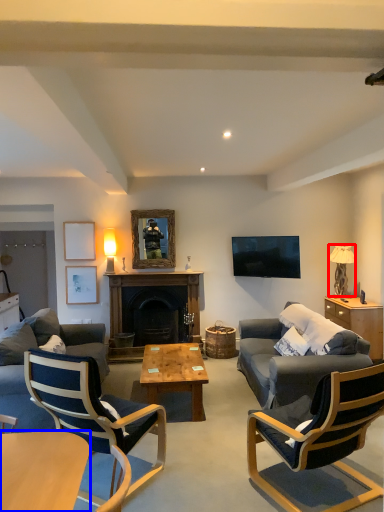
Question: Among these objects, which one is nearest to the camera, lamp (highlighted by a red box) or coffee table (highlighted by a blue box)?

Choices:
 (A) lamp
 (B) coffee table

Answer: (B)